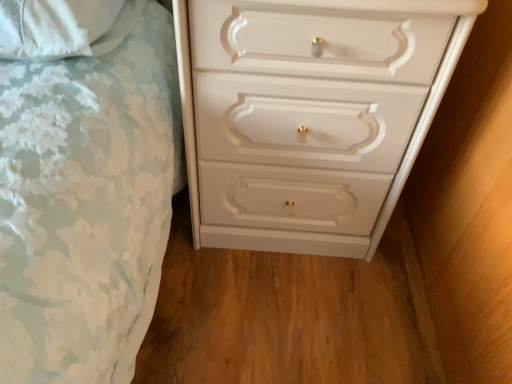
The height and width of the screenshot is (384, 512). Identify the location of white painted wood chest of drawers at lower right. (309, 115).

Measure the distance between white painted wood chest of drawers at lower right and camera.

white painted wood chest of drawers at lower right is 24.74 inches from camera.

What do you see at coordinates (309, 115) in the screenshot? The width and height of the screenshot is (512, 384). I see `white painted wood chest of drawers at lower right` at bounding box center [309, 115].

In order to face white painted wood chest of drawers at lower right, should I rotate leftwards or rightwards?

Rotate right and turn 5.859 degrees.

Find the location of a particular element. This screenshot has height=384, width=512. white painted wood chest of drawers at lower right is located at coordinates (309, 115).